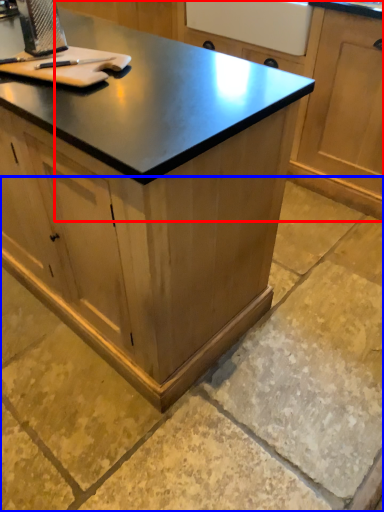
Question: Which object appears closest to the camera in this image, cabinetry (highlighted by a red box) or concrete (highlighted by a blue box)?

Choices:
 (A) cabinetry
 (B) concrete

Answer: (B)